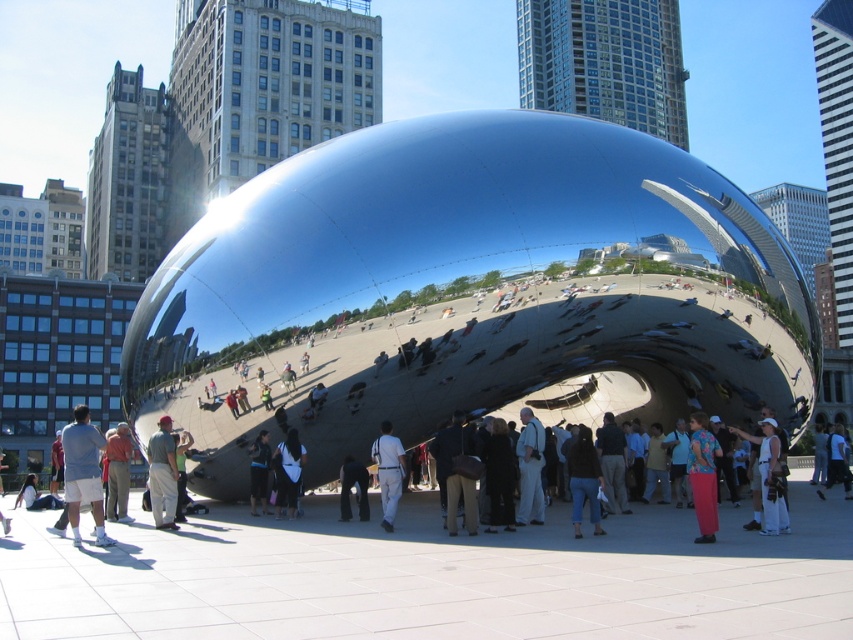
Question: Is white cotton shirt at lower right positioned in front of white cotton shirt at lower left?

Choices:
 (A) no
 (B) yes

Answer: (A)

Question: Is floral shirt at center smaller than white cotton shirt at lower right?

Choices:
 (A) no
 (B) yes

Answer: (B)

Question: Which object appears closest to the camera in this image?

Choices:
 (A) gray cotton shirt at lower left
 (B) floral shirt at center
 (C) white fabric pants at center
 (D) dark blue fabric at center

Answer: (A)

Question: Which point appears farthest from the camera in this image?

Choices:
 (A) (35, 500)
 (B) (78, 435)
 (C) (753, 500)
 (D) (386, 483)

Answer: (A)

Question: Which of the following is the farthest from the observer?

Choices:
 (A) floral shirt at center
 (B) matte black jacket at lower left

Answer: (B)

Question: Can you confirm if white cotton shirt at lower right is smaller than dark blue jeans at center?

Choices:
 (A) no
 (B) yes

Answer: (A)